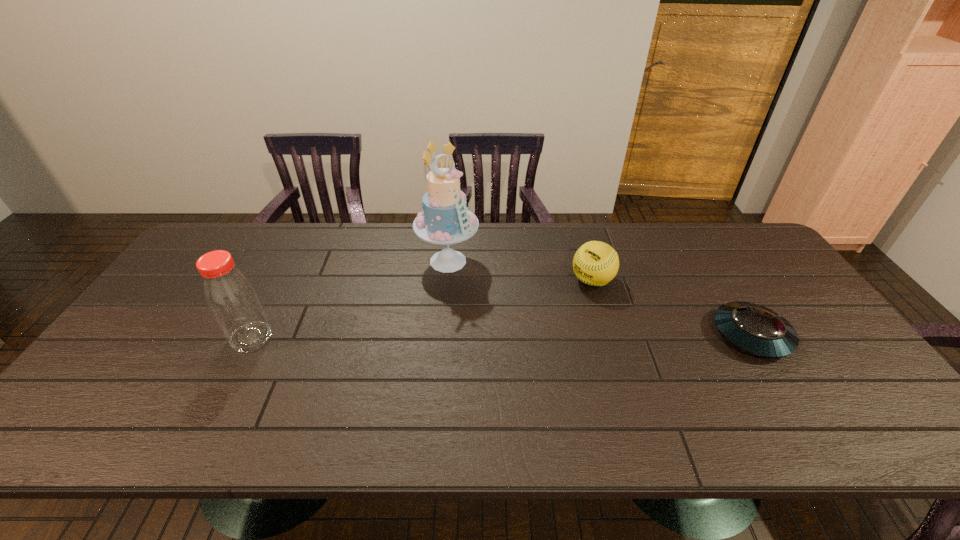
This screenshot has width=960, height=540. Identify the location of free space at the near edge of the desktop. (310, 382).

At what (x,y) coordinates should I click in order to perform the action: click on vacant space at the left edge. Please return your answer as a coordinate pair (x, y). The width and height of the screenshot is (960, 540). Looking at the image, I should click on (194, 290).

Image resolution: width=960 pixels, height=540 pixels. In the image, there is a desktop. In order to click on free space at the right edge in this screenshot , I will do `click(826, 347)`.

The image size is (960, 540). In the image, there is a desktop. Find the location of `vacant area at the near left corner`. vacant area at the near left corner is located at coordinates (x=138, y=383).

Where is `free space at the far right corner of the desktop`? free space at the far right corner of the desktop is located at coordinates (738, 225).

You are a GUI agent. You are given a task and a screenshot of the screen. Output one action in this format:
    pyautogui.click(x=<x>, y=<y>)
    Task: Click on the free space between the softball and the second tallest object
    
    Given the screenshot: What is the action you would take?
    pyautogui.click(x=421, y=309)

The width and height of the screenshot is (960, 540). Identify the location of unoccupied area between the second shortest object and the bottle. (421, 309).

Identify the location of free space between the bottle and the second object from left to right. (349, 299).

The image size is (960, 540). What are the coordinates of `empty space that is in between the tallest object and the shortest object` in the screenshot? It's located at (600, 298).

Locate an element on the screen. The image size is (960, 540). unoccupied area between the rightmost object and the second shortest object is located at coordinates (672, 308).